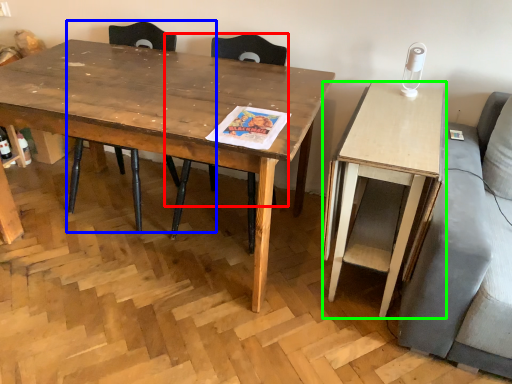
Question: Which is nearer to the chair (highlighted by a red box)? chair (highlighted by a blue box) or desk (highlighted by a green box).

Choices:
 (A) chair
 (B) desk

Answer: (A)